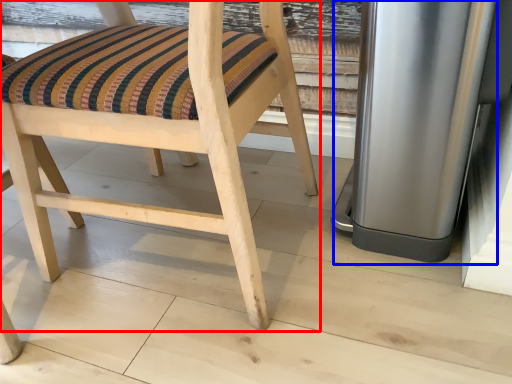
Question: Which object is closer to the camera taking this photo, chair (highlighted by a red box) or appliance (highlighted by a blue box)?

Choices:
 (A) chair
 (B) appliance

Answer: (A)